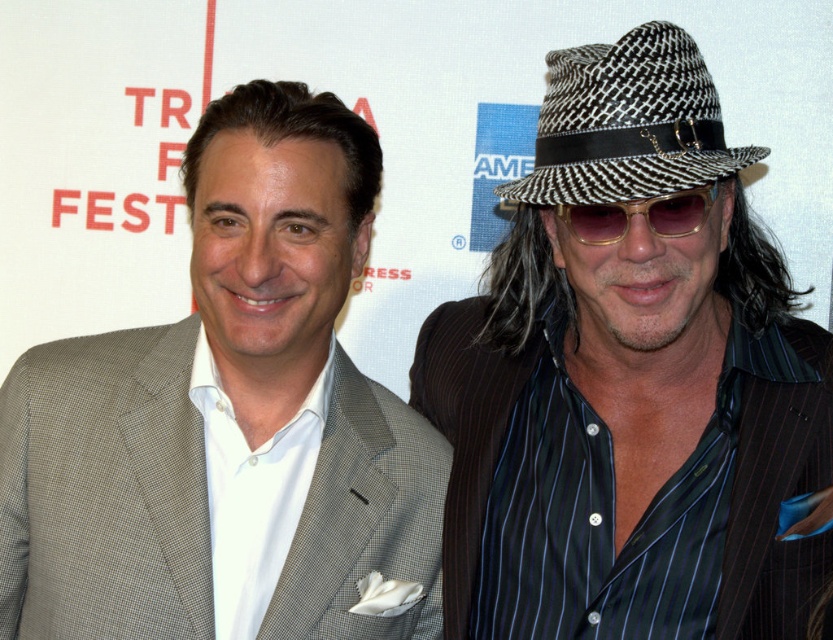
Question: Is black and white checkered hat at center to the right of black and white woven fedora at upper right from the viewer's perspective?

Choices:
 (A) no
 (B) yes

Answer: (B)

Question: Is black and white checkered hat at center to the left of gold metallic sunglasses at right from the viewer's perspective?

Choices:
 (A) no
 (B) yes

Answer: (A)

Question: Is matte gray suit at left in front of gold metallic sunglasses at right?

Choices:
 (A) no
 (B) yes

Answer: (B)

Question: Which object is the farthest from the black and white checkered hat at center?

Choices:
 (A) gold metallic sunglasses at right
 (B) matte gray suit at left

Answer: (B)

Question: Which of these objects is positioned closest to the matte gray suit at left?

Choices:
 (A) black and white woven fedora at upper right
 (B) black and white checkered hat at center
 (C) gold metallic sunglasses at right

Answer: (B)

Question: Which is nearer to the black and white checkered hat at center?

Choices:
 (A) gold metallic sunglasses at right
 (B) black and white woven fedora at upper right
 (C) matte gray suit at left

Answer: (B)